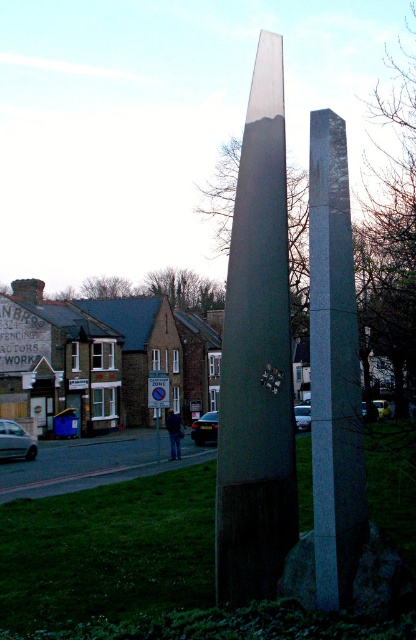
Consider the image. You are a city planner assessing the space between two obelisks in the image. The metallic polished obelisk at center and the granite stone obelisk at center. You need to install a bench that requires 1.2 meters of space. Can the bench fit between them?

The metallic polished obelisk at center is wider than the granite stone obelisk at center. However, the exact distance between them isn

You are an architect analyzing the layout of the urban space. You observe the metallic polished obelisk at center and the granite stone obelisk at center. Which one appears closer to you from your viewing position?

The metallic polished obelisk at center appears closer to you because it is positioned further to the viewer than the granite stone obelisk at center.